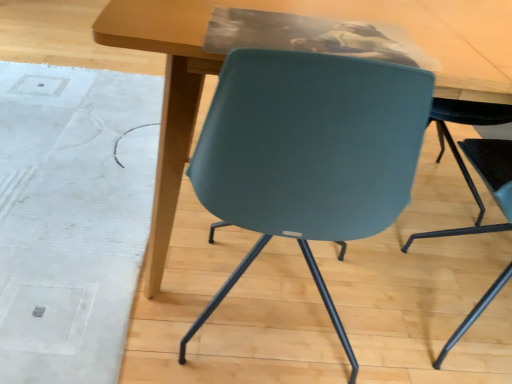
Question: Considering the positions of matte wood table at center and teal plastic chair at lower right in the image, is matte wood table at center wider or thinner than teal plastic chair at lower right?

Choices:
 (A) wide
 (B) thin

Answer: (A)

Question: Is matte wood table at center bigger or smaller than teal plastic chair at lower right?

Choices:
 (A) small
 (B) big

Answer: (B)

Question: Based on their relative distances, which object is farther from the matte wood table at center?

Choices:
 (A) white textured mat at lower left
 (B) teal plastic chair at lower right

Answer: (A)

Question: Estimate the real-world distances between objects in this image. Which object is farther from the white textured mat at lower left?

Choices:
 (A) teal plastic chair at lower right
 (B) matte wood table at center

Answer: (A)